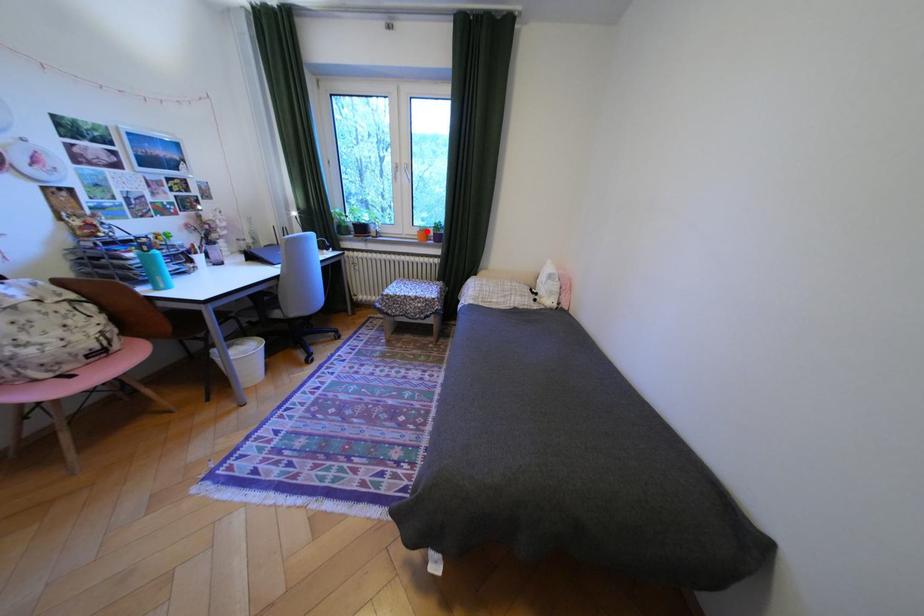
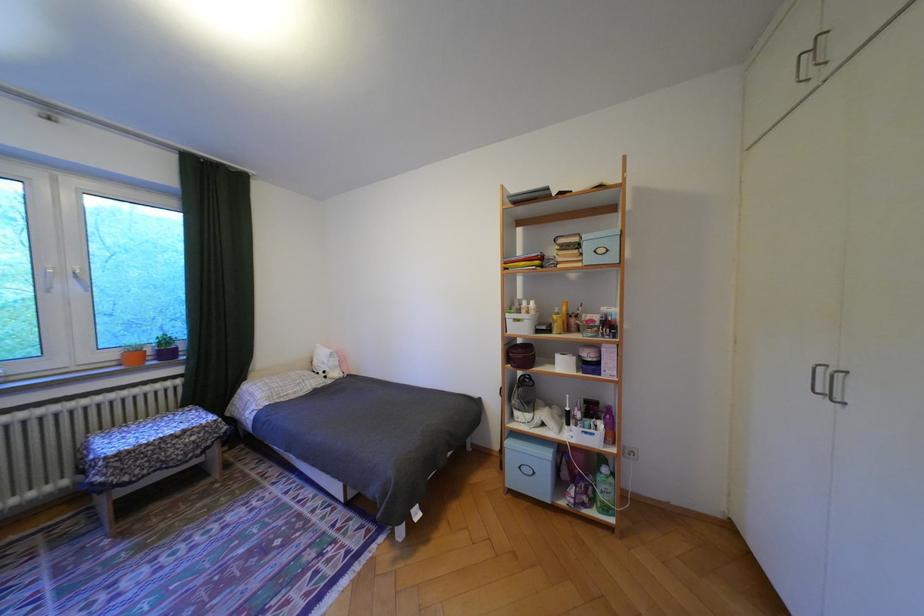
Question: I am providing you with two images of the same scene from different viewpoints. A red point is shown in image1. For the corresponding object point in image2, is it positioned nearer or farther from the camera?

Choices:
 (A) Nearer
 (B) Farther

Answer: (B)